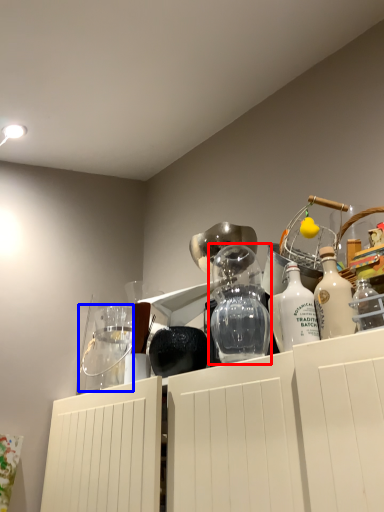
Question: Which of the following is the closest to the observer, glass vase (highlighted by a red box) or glass jar (highlighted by a blue box)?

Choices:
 (A) glass vase
 (B) glass jar

Answer: (A)